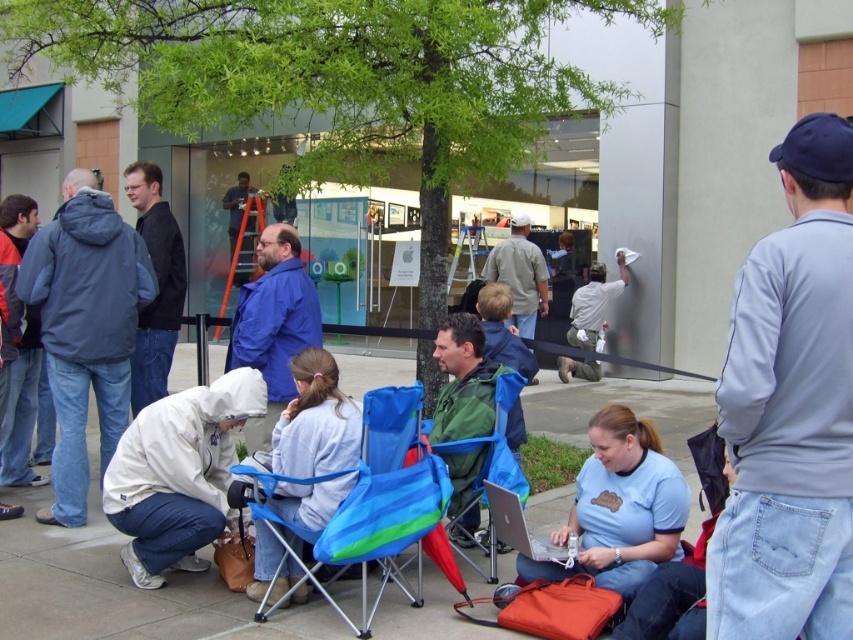
Between point (172, 280) and point (556, 554), which one is positioned in front?

Point (556, 554) is more forward.

Is point (148, 172) closer to camera compared to point (502, 496)?

That is False.

Locate an element on the screen. black matte jacket at upper left is located at coordinates (157, 285).

Does smooth concrete pavement at center have a smaller size compared to gray cotton shirt at center?

Actually, smooth concrete pavement at center might be larger than gray cotton shirt at center.

Can you confirm if smooth concrete pavement at center is taller than gray cotton shirt at center?

Incorrect, smooth concrete pavement at center's height is not larger of gray cotton shirt at center's.

Is point (415, 630) farther from camera compared to point (498, 250)?

That is False.

Locate an element on the screen. The height and width of the screenshot is (640, 853). smooth concrete pavement at center is located at coordinates 120,586.

Does blue fabric chair at center appear under green matte jacket at center?

Yes.

Consider the image. Can you confirm if blue fabric chair at center is taller than green matte jacket at center?

In fact, blue fabric chair at center may be shorter than green matte jacket at center.

In the scene shown: Who is more forward, (294, 536) or (463, 406)?

Positioned in front is point (294, 536).

Find the location of `blue fabric chair at center`. blue fabric chair at center is located at coordinates 372,496.